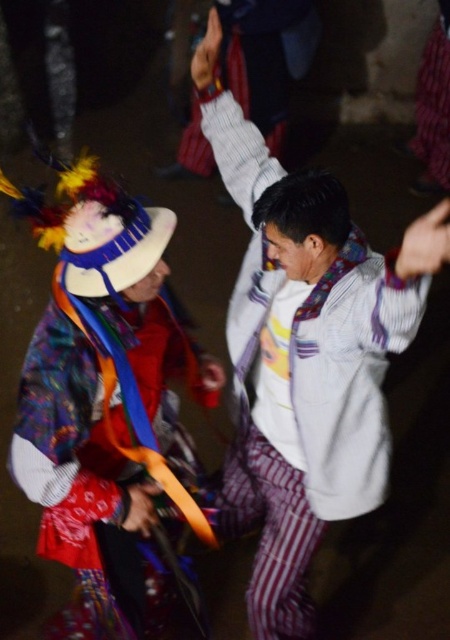
You are taking a photo of two people in a festive scene. The first person is at point (x=298, y=554) and the second person is at point (x=194, y=509). Which person is closer to the camera?

Point (x=298, y=554) is further to the camera than point (x=194, y=509), so the second person at point (x=194, y=509) is closer to the camera.

You are a photographer standing in front of the two people in the scene. You need to take a photo that includes both the white striped shirt at center and the velvet purple scarf at upper right. Which object should you focus on first to ensure both are in clear focus?

The white striped shirt at center is closer to the viewer than the velvet purple scarf at upper right. To ensure both are in clear focus, you should focus on the white striped shirt at center first, as it is the closer object. This will create a depth of field that includes the velvet purple scarf at upper right in the background.

You are a photographer trying to capture a photo of the two people in the scene. The white striped shirt at center and the velvet purple scarf at upper right are both in your viewfinder. If you want to focus on the taller object, which one should you adjust your camera to focus on?

The white striped shirt at center is much taller than the velvet purple scarf at upper right, so you should focus on the white striped shirt at center.